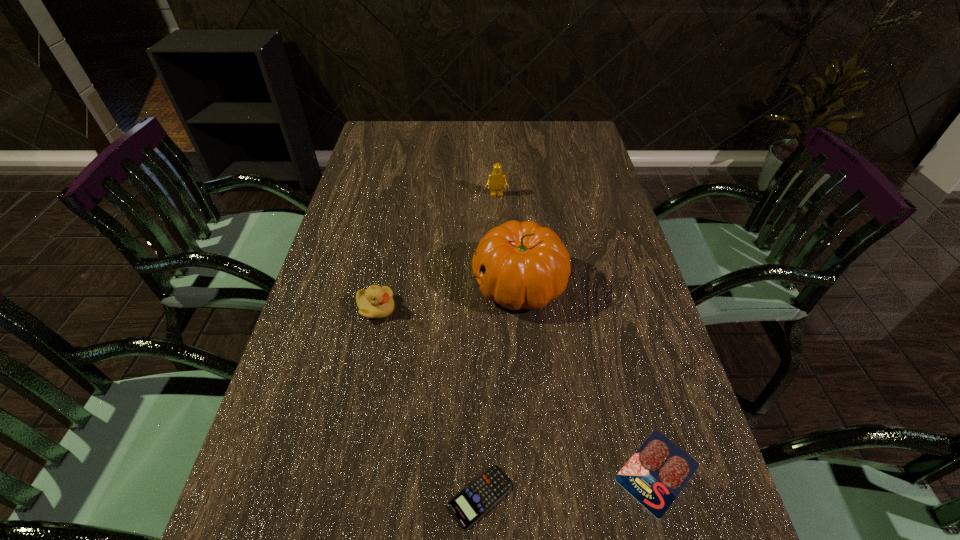
Identify the location of vacant space in between the calculator and the salami. The width and height of the screenshot is (960, 540). (568, 484).

You are a GUI agent. You are given a task and a screenshot of the screen. Output one action in this format:
    pyautogui.click(x=<x>, y=<y>)
    Task: Click on the unoccupied area between the calculator and the second tallest object
    
    Given the screenshot: What is the action you would take?
    pyautogui.click(x=489, y=346)

At what (x,y) coordinates should I click in order to perform the action: click on free space between the calculator and the duckling. Please return your answer as a coordinate pair (x, y). Looking at the image, I should click on (428, 403).

Find the location of a particular element. This screenshot has width=960, height=540. empty space between the calculator and the pumpkin is located at coordinates (500, 390).

Find the location of a particular element. The width and height of the screenshot is (960, 540). vacant area that lies between the fourth shortest object and the salami is located at coordinates (577, 334).

Locate an element on the screen. This screenshot has height=540, width=960. free space between the calculator and the third shortest object is located at coordinates point(428,403).

At what (x,y) coordinates should I click in order to perform the action: click on free space that is in between the tallest object and the calculator. Please return your answer as a coordinate pair (x, y). This screenshot has height=540, width=960. Looking at the image, I should click on (500, 390).

Image resolution: width=960 pixels, height=540 pixels. In order to click on vacant space that's between the second tallest object and the calculator in this screenshot , I will do `click(489, 346)`.

Locate an element on the screen. The height and width of the screenshot is (540, 960). free point between the calculator and the tallest object is located at coordinates (500, 390).

I want to click on object that stands as the second closest to the leftmost object, so click(x=470, y=504).